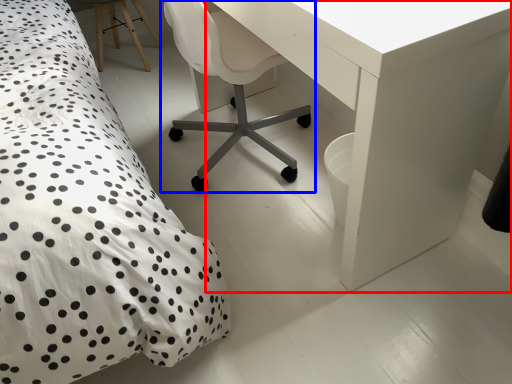
Question: Which point is closer to the camera, table (highlighted by a red box) or chair (highlighted by a blue box)?

Choices:
 (A) table
 (B) chair

Answer: (A)